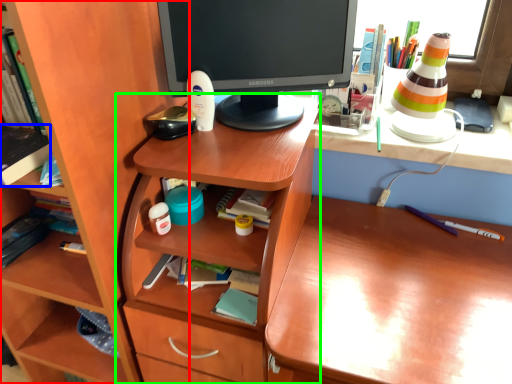
Question: Which is farther away from shelf (highlighted by a red box)? book (highlighted by a blue box) or table (highlighted by a green box)?

Choices:
 (A) book
 (B) table

Answer: (A)